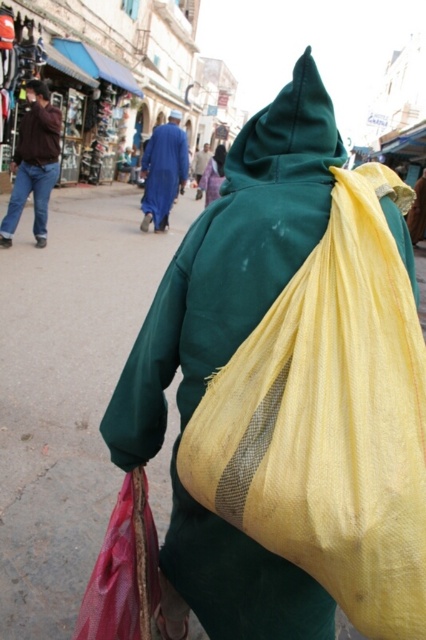
From the picture: You are a photographer trying to capture the yellow woven bag at back in your shot. Based on its position, where should you aim your camera?

The yellow woven bag at back is located at the 2D coordinates of point 0.656 on the x axis and 0.775 on the y axis, so aim your camera towards that point to capture it.

You are standing at the point with coordinates point (175, 193) and want to walk to the point with coordinates point (140, 483). Which direction should you move in to reach your destination?

You should move forward because point (140, 483) is in front of point (175, 193).